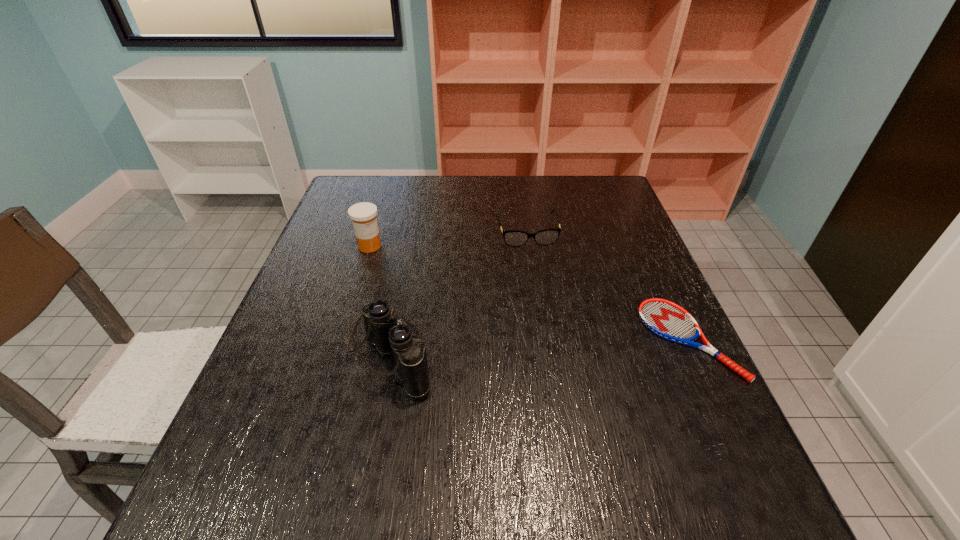
I want to click on free space on the desktop that is between the binoculars and the tennis racket and is positioned on the label of the third shortest object, so tap(578, 344).

This screenshot has height=540, width=960. I want to click on vacant space on the desktop that is between the binoculars and the shortest object and is positioned on the front-facing side of the spectacles, so click(556, 345).